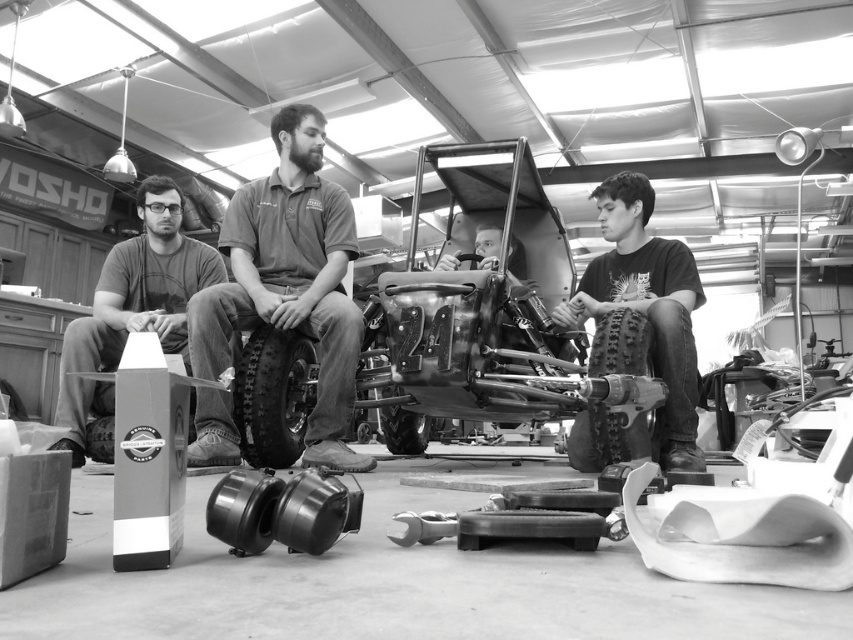
Question: Is rubber/textured tire at center below rubber/soft tire at lower center?

Choices:
 (A) no
 (B) yes

Answer: (A)

Question: Which object is closer to the camera taking this photo?

Choices:
 (A) rubber/textured tire at lower right
 (B) rubber/textured tire at center

Answer: (A)

Question: Can you confirm if metallic/textured car at center is thinner than rubber/soft tire at lower center?

Choices:
 (A) no
 (B) yes

Answer: (A)

Question: Is black matte shirt at center positioned in front of metallic silver helmet at center?

Choices:
 (A) no
 (B) yes

Answer: (B)

Question: Which point is farther to the camera?

Choices:
 (A) rubber/textured tire at lower right
 (B) metallic silver helmet at center

Answer: (B)

Question: Considering the real-world distances, which object is farthest from the rubber/textured tire at center?

Choices:
 (A) rubber/textured tire at lower right
 (B) metallic/textured car at center

Answer: (A)